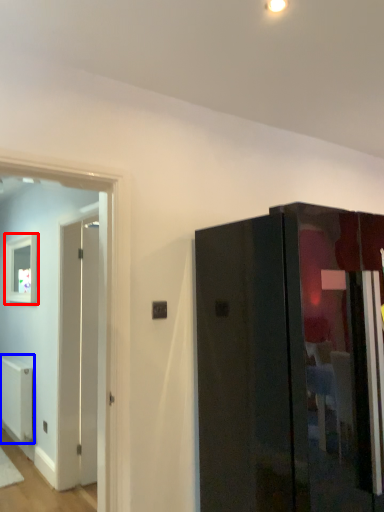
Question: Which object is further to the camera taking this photo, picture frame (highlighted by a red box) or radiator (highlighted by a blue box)?

Choices:
 (A) picture frame
 (B) radiator

Answer: (A)